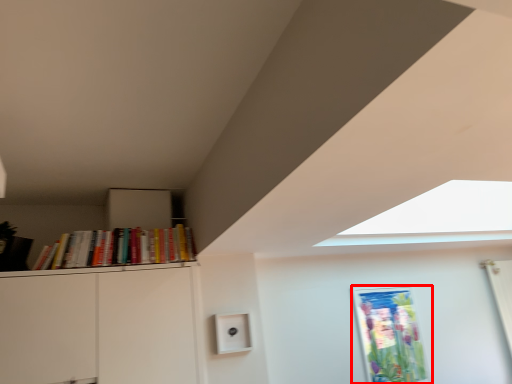
Question: From the image's perspective, what is the correct spatial relationship of picture frame (annotated by the red box) in relation to book?

Choices:
 (A) below
 (B) above

Answer: (A)